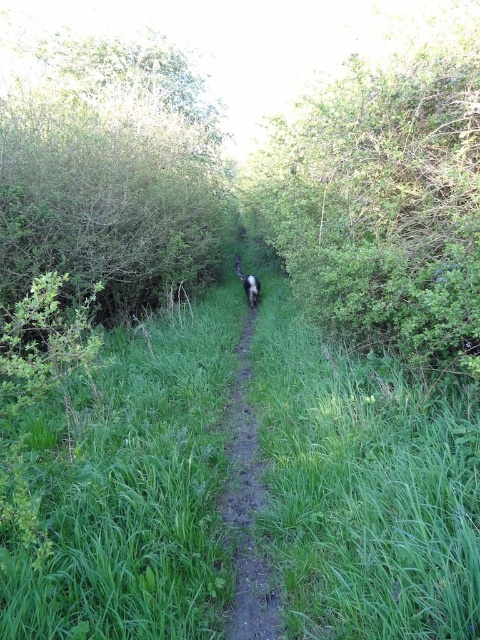
You are standing at the starting point of the path and see two points marked on the path ahead of you. The first point is at coordinates point (47, 609) and the second is at point (231, 406). Which point is closer to you?

Point (47, 609) is closer to the camera than point (231, 406), so the first point is closer to you.

You are a hiker who wants to take a shortcut from the green leafy tree at upper left to the green leafy bush at center. Which direction should you move relative to the tree?

You should move to the right relative to the green leafy tree at upper left to reach the green leafy bush at center since the bush is positioned to the right of the tree.

In the scene shown: You are standing at the start of the path and see the point marked at coordinates (384,202). What object is located at that point?

The point at coordinates (384,202) corresponds to the green leafy bush at center.